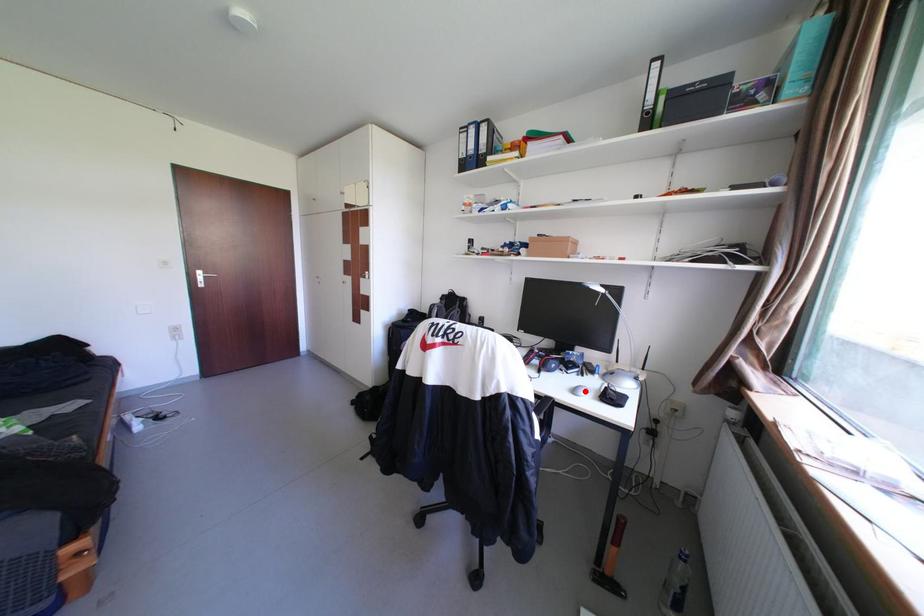
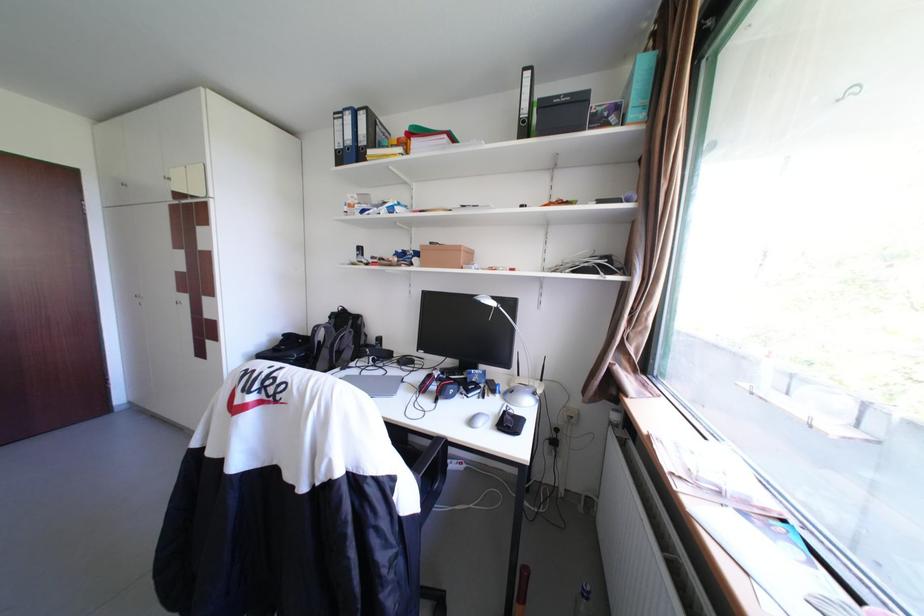
In the second image, find the point that corresponds to the highlighted location in the first image.

(481, 422)